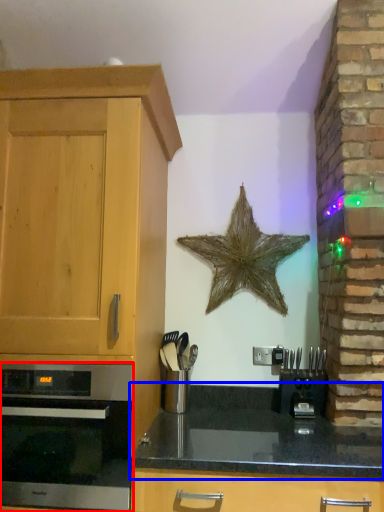
Question: Among these objects, which one is nearest to the camera, oven (highlighted by a red box) or countertop (highlighted by a blue box)?

Choices:
 (A) oven
 (B) countertop

Answer: (B)